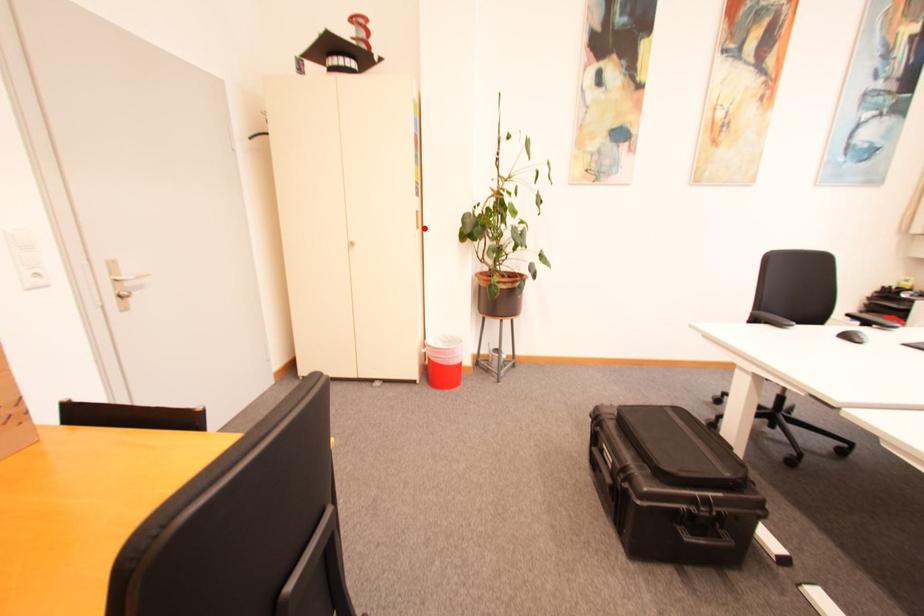
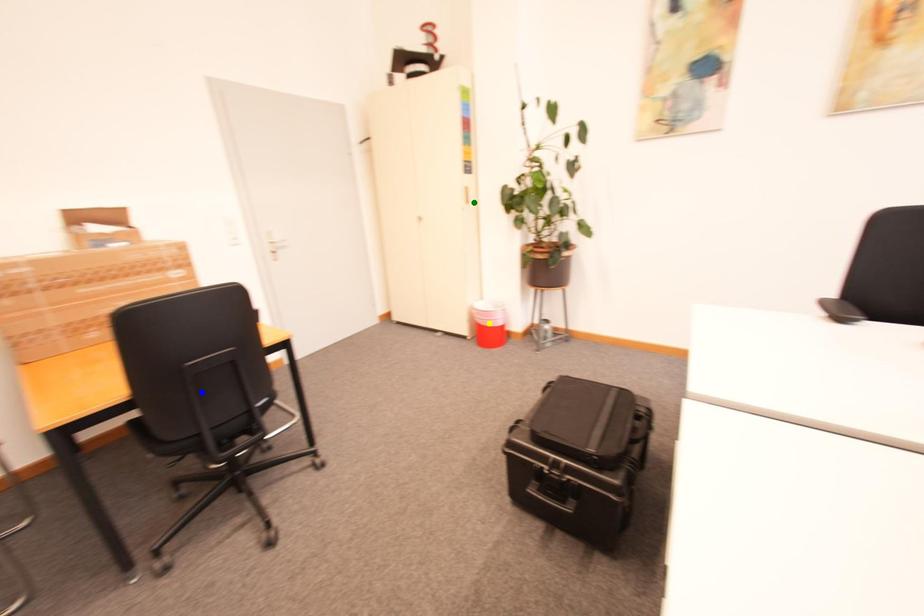
Question: I am providing you with two images of the same scene from different viewpoints. A red point is marked on the first image. You are given multiple points on the second image. Which point in image 2 is actually the same real-world point as the red point in image 1?

Choices:
 (A) green point
 (B) yellow point
 (C) blue point

Answer: (A)